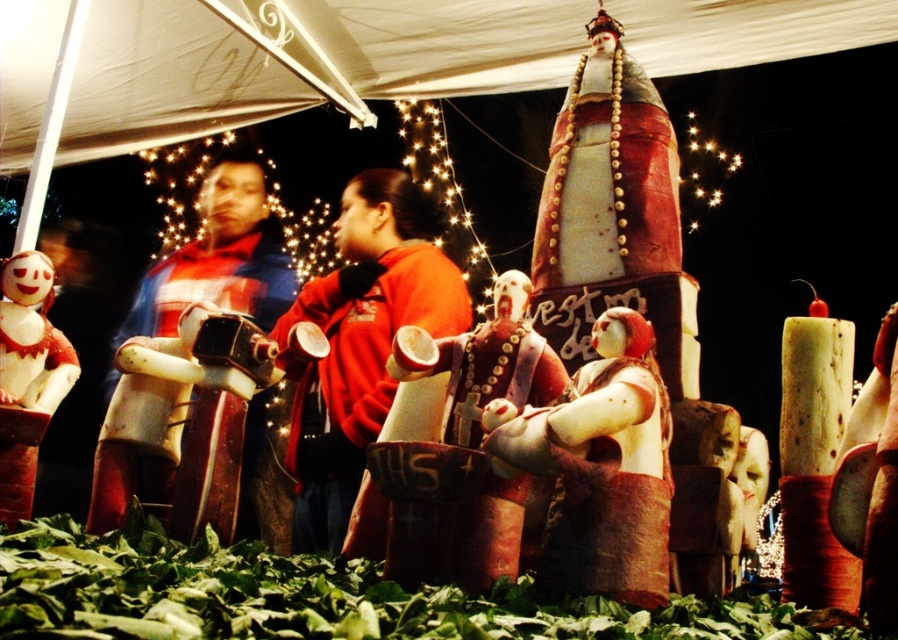
Question: Which point is closer to the camera taking this photo?

Choices:
 (A) (256, 432)
 (B) (50, 275)
 (C) (433, 212)

Answer: (B)

Question: Is red matte jacket at center positioned in front of red plaid shirt at left?

Choices:
 (A) no
 (B) yes

Answer: (A)

Question: Which point is farther to the camera?

Choices:
 (A) red matte jacket at center
 (B) red plaid shirt at left
 (C) white matte doll at lower left
 (D) matte wooden statue at center

Answer: (A)

Question: Can you confirm if matte white figure at center is positioned above white matte doll at lower left?

Choices:
 (A) no
 (B) yes

Answer: (A)

Question: Is red matte jacket at center smaller than white matte doll at lower left?

Choices:
 (A) yes
 (B) no

Answer: (B)

Question: Which point appears farthest from the camera in this image?

Choices:
 (A) click(209, 179)
 (B) click(441, 560)
 (C) click(737, 156)
 (D) click(511, 435)

Answer: (C)